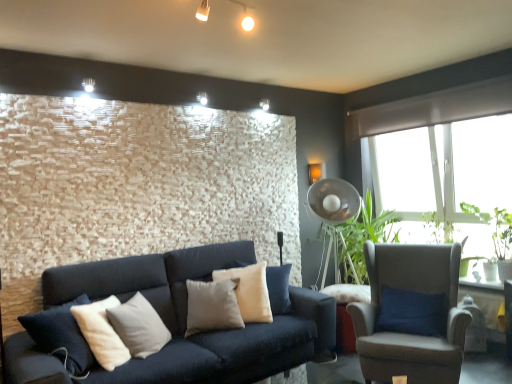
Question: Does green leafy plant at right, positioned as the 2th plant in back-to-front order, have a smaller size compared to green leafy plant at right, the 1th plant from the back?

Choices:
 (A) yes
 (B) no

Answer: (B)

Question: Considering the relative sizes of green leafy plant at right, placed as the 1th plant when sorted from front to back, and green leafy plant at right, marked as the second plant in a front-to-back arrangement, in the image provided, is green leafy plant at right, placed as the 1th plant when sorted from front to back, thinner than green leafy plant at right, marked as the second plant in a front-to-back arrangement,?

Choices:
 (A) yes
 (B) no

Answer: (B)

Question: Is green leafy plant at right, placed as the 1th plant when sorted from front to back, taller than green leafy plant at right, the 1th plant from the back?

Choices:
 (A) no
 (B) yes

Answer: (B)

Question: Is green leafy plant at right, positioned as the 2th plant in back-to-front order, further to camera compared to green leafy plant at right, the 1th plant from the back?

Choices:
 (A) yes
 (B) no

Answer: (B)

Question: Are green leafy plant at right, placed as the 1th plant when sorted from front to back, and green leafy plant at right, the 1th plant from the back, making contact?

Choices:
 (A) no
 (B) yes

Answer: (B)

Question: Is green leafy plant at right, the 1th plant from the back, wider or thinner than metallic silver fan at center-right?

Choices:
 (A) thin
 (B) wide

Answer: (A)

Question: Considering the positions of green leafy plant at right, marked as the second plant in a front-to-back arrangement, and metallic silver fan at center-right in the image, is green leafy plant at right, marked as the second plant in a front-to-back arrangement, taller or shorter than metallic silver fan at center-right?

Choices:
 (A) short
 (B) tall

Answer: (A)

Question: Visually, is green leafy plant at right, the 1th plant from the back, positioned to the left or to the right of metallic silver fan at center-right?

Choices:
 (A) right
 (B) left

Answer: (A)

Question: From the image's perspective, is green leafy plant at right, the 1th plant from the back, located above or below metallic silver fan at center-right?

Choices:
 (A) below
 (B) above

Answer: (B)

Question: Is metallic silver fan at center-right wider or thinner than light beige fabric armchair at right?

Choices:
 (A) wide
 (B) thin

Answer: (B)

Question: From the image's perspective, relative to light beige fabric armchair at right, is metallic silver fan at center-right above or below?

Choices:
 (A) above
 (B) below

Answer: (A)

Question: From a real-world perspective, is metallic silver fan at center-right physically located above or below light beige fabric armchair at right?

Choices:
 (A) above
 (B) below

Answer: (A)

Question: Looking at the image, does metallic silver fan at center-right seem bigger or smaller compared to light beige fabric armchair at right?

Choices:
 (A) small
 (B) big

Answer: (A)

Question: Is point (452, 228) closer or farther from the camera than point (433, 241)?

Choices:
 (A) farther
 (B) closer

Answer: (A)

Question: Looking at their shapes, would you say green leafy plant at right, placed as the 1th plant when sorted from front to back, is wider or thinner than green leafy plant at right, marked as the second plant in a front-to-back arrangement?

Choices:
 (A) thin
 (B) wide

Answer: (B)